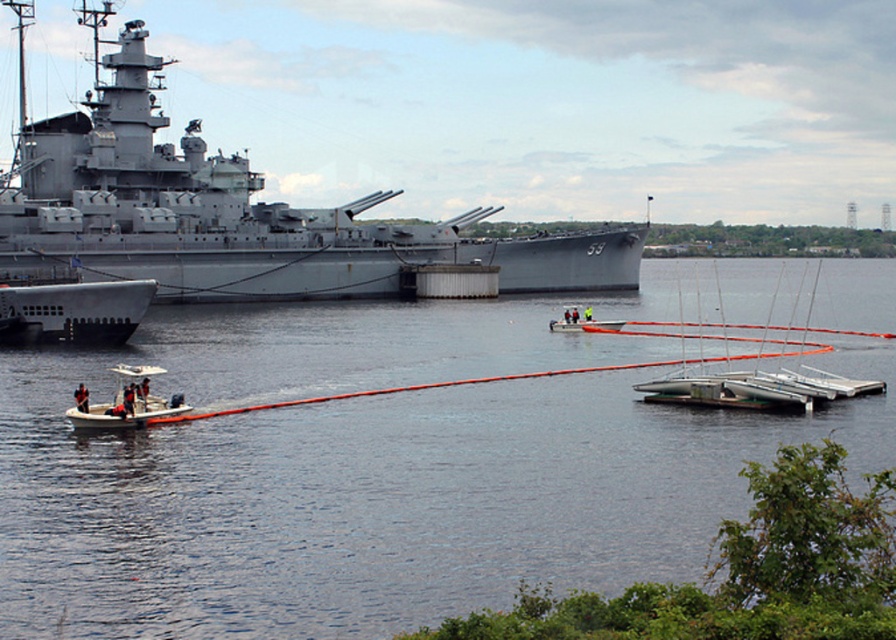
Between brushed metal boat at left and yellow life vest at lower left, which one has less height?

Standing shorter between the two is yellow life vest at lower left.

Who is higher up, brushed metal boat at left or yellow life vest at lower left?

brushed metal boat at left is above.

Which is behind, point (71, 342) or point (584, 317)?

Point (584, 317)

This screenshot has width=896, height=640. In order to click on brushed metal boat at left in this screenshot , I will do `click(72, 310)`.

What do you see at coordinates (128, 403) in the screenshot?
I see `white plastic boat at left` at bounding box center [128, 403].

Between white plastic boat at left and dark blue fabric life jacket at lower left, which one appears on the right side from the viewer's perspective?

Positioned to the right is white plastic boat at left.

Who is more forward, (102,412) or (83,385)?

Point (102,412) is in front.

Locate an element on the screen. Image resolution: width=896 pixels, height=640 pixels. white plastic boat at left is located at coordinates (128, 403).

Does white plastic boat at left come in front of white plastic boat at center?

Yes.

Between white plastic boat at left and white plastic boat at center, which one has more height?

With more height is white plastic boat at center.

Which is behind, point (151, 413) or point (567, 328)?

Point (567, 328)

Image resolution: width=896 pixels, height=640 pixels. In order to click on white plastic boat at left in this screenshot , I will do `click(128, 403)`.